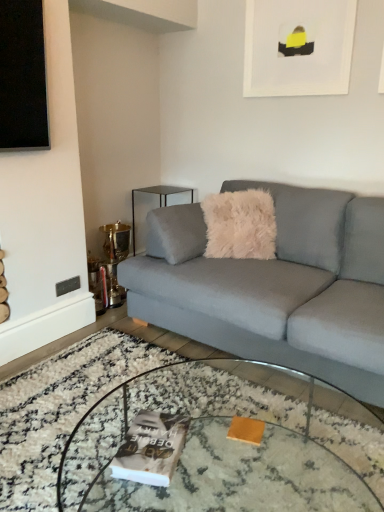
Measure the distance between point (109, 407) and camera.

A distance of 4.70 feet exists between point (109, 407) and camera.

Where is `white matte picture frame at upper center`? This screenshot has height=512, width=384. white matte picture frame at upper center is located at coordinates (298, 47).

The width and height of the screenshot is (384, 512). What are the coordinates of `light gray fabric couch at center` in the screenshot? It's located at (279, 288).

How different are the orientations of clear glass coffee table at center and matte gray magazine at center in degrees?

The angular difference between clear glass coffee table at center and matte gray magazine at center is 21.9 degrees.

In the image, is clear glass coffee table at center on the left side or the right side of matte gray magazine at center?

clear glass coffee table at center is to the right of matte gray magazine at center.

From the image's perspective, is clear glass coffee table at center located above matte gray magazine at center?

No, from the image's perspective, clear glass coffee table at center is not over matte gray magazine at center.

Considering the relative positions of white matte picture frame at upper center and fuzzy beige pillow at center in the image provided, is white matte picture frame at upper center to the left or to the right of fuzzy beige pillow at center?

In the image, white matte picture frame at upper center appears on the right side of fuzzy beige pillow at center.

Looking at this image, is white matte picture frame at upper center placed right next to fuzzy beige pillow at center?

No, white matte picture frame at upper center is not beside fuzzy beige pillow at center.

From the image's perspective, is white matte picture frame at upper center located above or below fuzzy beige pillow at center?

white matte picture frame at upper center is above fuzzy beige pillow at center.

Considering the positions of objects white matte picture frame at upper center and fuzzy beige pillow at center in the image provided, who is in front, white matte picture frame at upper center or fuzzy beige pillow at center?

white matte picture frame at upper center.

Which object is thinner, clear glass side table at upper left or white matte picture frame at upper center?

white matte picture frame at upper center is thinner.

Does point (159, 193) come farther from viewer compared to point (302, 40)?

Yes, it is.

Does clear glass side table at upper left contain white matte picture frame at upper center?

No, white matte picture frame at upper center is not a part of clear glass side table at upper left.

From a real-world perspective, is clear glass side table at upper left located beneath white matte picture frame at upper center?

Yes, from a real-world perspective, clear glass side table at upper left is beneath white matte picture frame at upper center.

Is clear glass side table at upper left spatially inside matte gray magazine at center, or outside of it?

clear glass side table at upper left lies outside matte gray magazine at center.

Is point (173, 192) positioned after point (177, 461)?

That is True.

Consider the image. From the image's perspective, is clear glass side table at upper left above matte gray magazine at center?

Correct, clear glass side table at upper left appears higher than matte gray magazine at center in the image.

Between clear glass side table at upper left and matte gray magazine at center, which one has larger size?

clear glass side table at upper left.

Measure the distance from clear glass side table at upper left to fuzzy beige pillow at center.

clear glass side table at upper left is 35.69 inches away from fuzzy beige pillow at center.

Is clear glass side table at upper left positioned in front of fuzzy beige pillow at center?

That is False.

Based on the photo, from the image's perspective, is clear glass side table at upper left located beneath fuzzy beige pillow at center?

No.

Is clear glass side table at upper left wider than fuzzy beige pillow at center?

Yes.

How many degrees apart are the facing directions of light gray fabric couch at center and clear glass side table at upper left?

The angle between the facing direction of light gray fabric couch at center and the facing direction of clear glass side table at upper left is 88.7 degrees.

Does point (373, 398) appear closer or farther from the camera than point (163, 194)?

Clearly, point (373, 398) is closer to the camera than point (163, 194).

Is clear glass side table at upper left at the back of light gray fabric couch at center?

light gray fabric couch at center is not turned away from clear glass side table at upper left.

Is light gray fabric couch at center beside clear glass side table at upper left?

light gray fabric couch at center and clear glass side table at upper left are clearly separated.

Is clear glass side table at upper left wider or thinner than light gray fabric couch at center?

clear glass side table at upper left is thinner than light gray fabric couch at center.

Is clear glass side table at upper left to the right of light gray fabric couch at center from the viewer's perspective?

In fact, clear glass side table at upper left is to the left of light gray fabric couch at center.

Is clear glass side table at upper left positioned with its back to light gray fabric couch at center?

clear glass side table at upper left does not have its back to light gray fabric couch at center.

Is there a large distance between clear glass side table at upper left and light gray fabric couch at center?

Indeed, clear glass side table at upper left is not near light gray fabric couch at center.

Locate an element on the screen. coffee table in front of the matte gray magazine at center is located at coordinates (230, 445).

Find the location of a particular element. The width and height of the screenshot is (384, 512). throw pillow behind the white matte picture frame at upper center is located at coordinates (240, 225).

Based on their spatial positions, is clear glass coffee table at center or clear glass side table at upper left closer to white matte picture frame at upper center?

clear glass side table at upper left is positioned closer to the anchor white matte picture frame at upper center.

When comparing their distances from clear glass side table at upper left, does fuzzy beige pillow at center or light gray fabric couch at center seem closer?

fuzzy beige pillow at center is closer to clear glass side table at upper left.

From the picture: Considering their positions, is clear glass side table at upper left positioned closer to matte gray magazine at center than fuzzy beige pillow at center?

fuzzy beige pillow at center lies closer to matte gray magazine at center than the other object.

When comparing their distances from clear glass coffee table at center, does light gray fabric couch at center or white matte picture frame at upper center seem further?

white matte picture frame at upper center.

Considering their positions, is fuzzy beige pillow at center positioned further to matte gray magazine at center than white matte picture frame at upper center?

Based on the image, white matte picture frame at upper center appears to be further to matte gray magazine at center.

From the picture: Based on their spatial positions, is light gray fabric couch at center or clear glass coffee table at center closer to white matte picture frame at upper center?

light gray fabric couch at center.

Estimate the real-world distances between objects in this image. Which object is closer to white matte picture frame at upper center, matte gray magazine at center or clear glass coffee table at center?

Based on the image, clear glass coffee table at center appears to be nearer to white matte picture frame at upper center.

When comparing their distances from clear glass side table at upper left, does clear glass coffee table at center or white matte picture frame at upper center seem closer?

The object closer to clear glass side table at upper left is white matte picture frame at upper center.

Find the location of a particular element. The height and width of the screenshot is (512, 384). magazine between white matte picture frame at upper center and clear glass coffee table at center in the vertical direction is located at coordinates [151, 448].

You are a GUI agent. You are given a task and a screenshot of the screen. Output one action in this format:
    pyautogui.click(x=<x>, y=<y>)
    Task: Click on the studio couch between matte gray magazine at center and fuzzy beige pillow at center from front to back
    This screenshot has height=512, width=384.
    Given the screenshot: What is the action you would take?
    pyautogui.click(x=279, y=288)

The image size is (384, 512). Identify the location of throw pillow between white matte picture frame at upper center and matte gray magazine at center in the vertical direction. point(240,225).

The width and height of the screenshot is (384, 512). What are the coordinates of `throw pillow between clear glass coffee table at center and clear glass side table at upper left from front to back` in the screenshot? It's located at (240, 225).